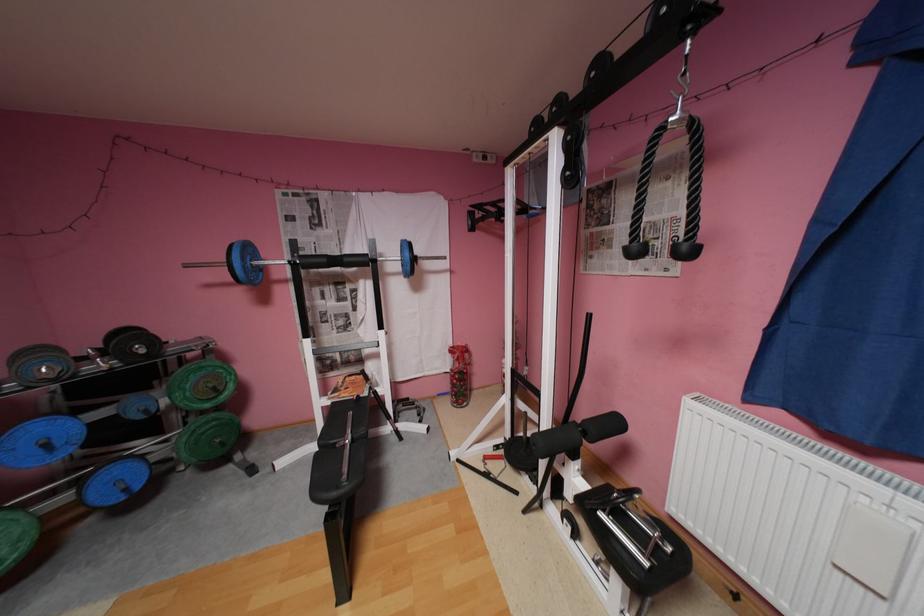
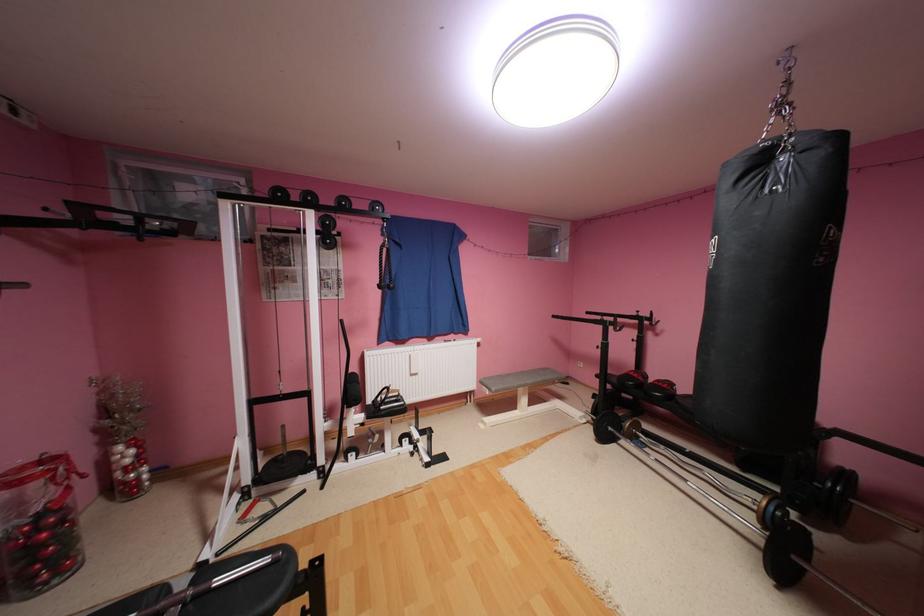
The point at (517, 435) is marked in the first image. Where is the corresponding point in the second image?

(256, 479)